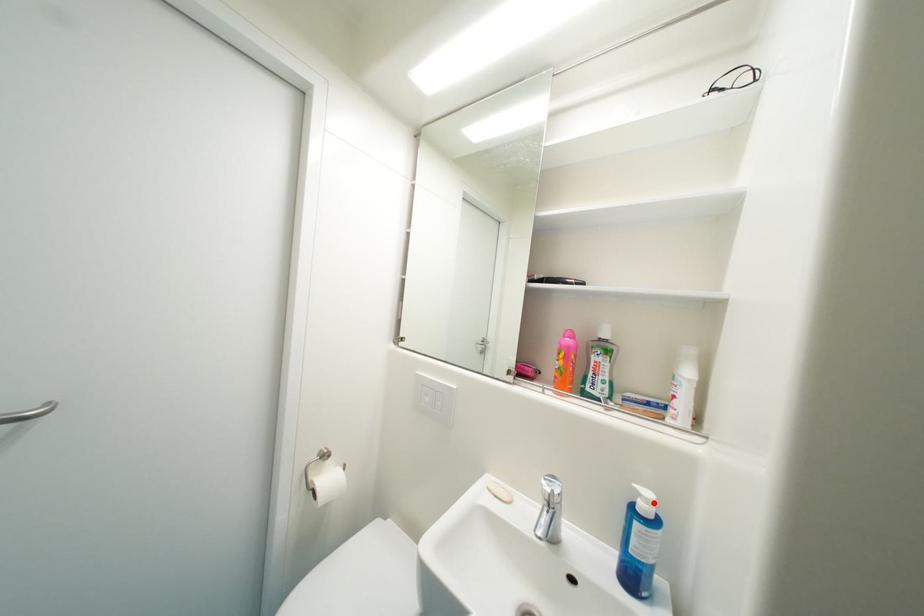
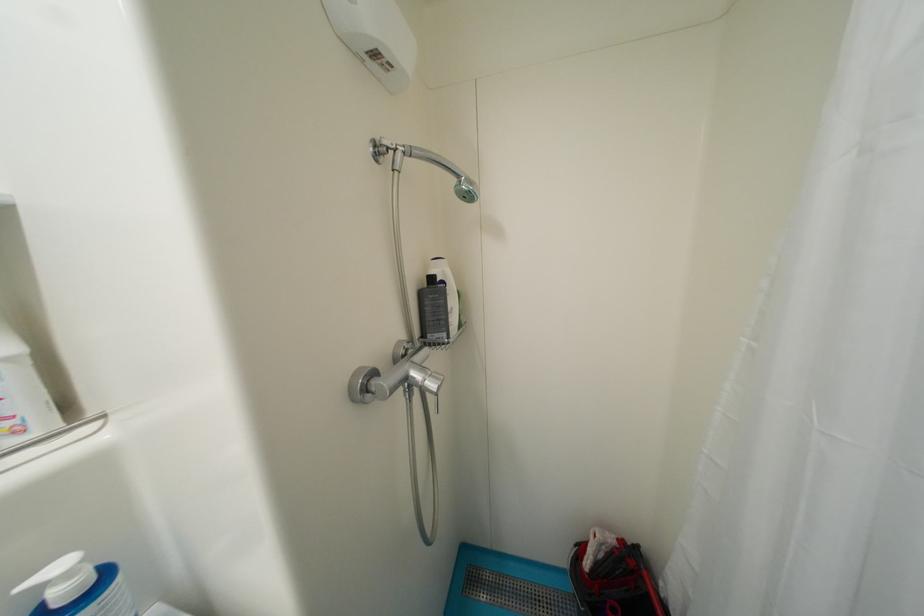
Where in the second image is the point corresponding to the highlighted location from the first image?

(75, 576)